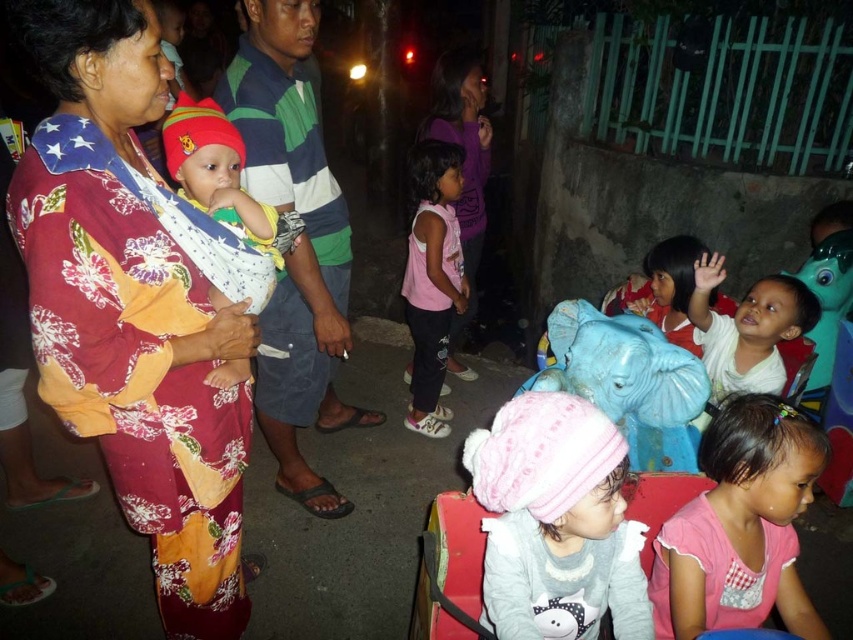
Question: Which point is farther to the camera?

Choices:
 (A) (99, 58)
 (B) (770, 481)
 (C) (770, 298)

Answer: (C)

Question: Does pink fabric shirt at lower right have a lesser width compared to matte blue elephant at center?

Choices:
 (A) no
 (B) yes

Answer: (A)

Question: Which point is farther from the camera taking this photo?

Choices:
 (A) (415, 152)
 (B) (201, 150)

Answer: (A)

Question: Does pink fabric shirt at lower right lie in front of soft white baby at center?

Choices:
 (A) yes
 (B) no

Answer: (A)

Question: Is floral fabric woman at center wider than soft white baby at center?

Choices:
 (A) no
 (B) yes

Answer: (A)

Question: Which point is closer to the camera?

Choices:
 (A) striped cotton shirt at center
 (B) soft white baby at center
 (C) matte yellow blanket at center

Answer: (C)